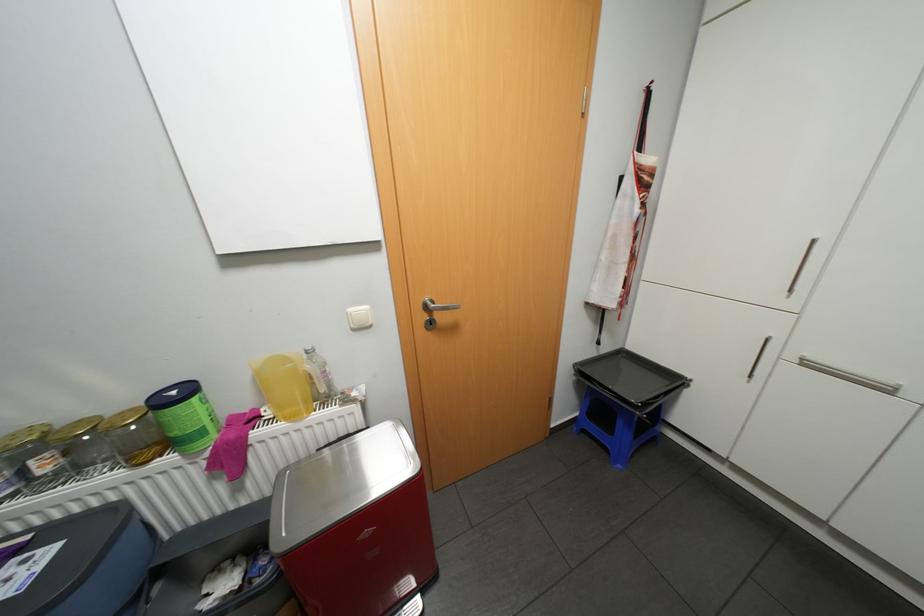
The height and width of the screenshot is (616, 924). Find the location of `yellow plastic pitcher`. yellow plastic pitcher is located at coordinates (284, 385).